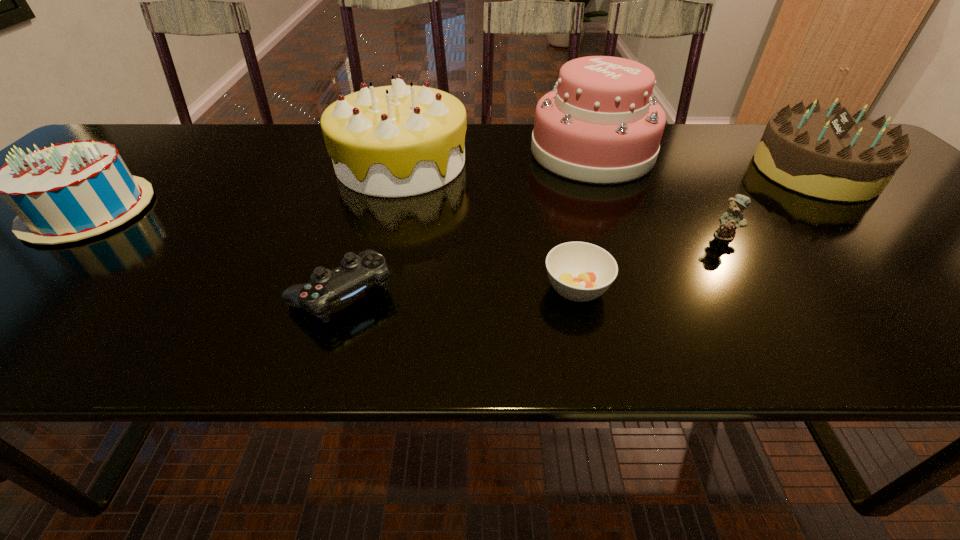
This screenshot has height=540, width=960. What are the coordinates of `vacant region at the near edge` in the screenshot? It's located at (648, 315).

This screenshot has height=540, width=960. Find the location of `free location at the left edge of the desktop`. free location at the left edge of the desktop is located at coordinates (12, 230).

This screenshot has width=960, height=540. Identify the location of vacant area at the right edge. (948, 264).

Find the location of a particular element. Image resolution: width=960 pixels, height=540 pixels. free space at the far left corner of the desktop is located at coordinates (150, 132).

At what (x,y) coordinates should I click in order to perform the action: click on vacant region between the third shortest object and the second shortest object. Please return your answer as a coordinate pair (x, y). The width and height of the screenshot is (960, 540). Looking at the image, I should click on click(534, 264).

Image resolution: width=960 pixels, height=540 pixels. I want to click on empty space that is in between the rightmost birthday cake and the fifth tallest object, so click(770, 203).

Where is `vacant space that is in between the tallest birthday cake and the sixth tallest object`? vacant space that is in between the tallest birthday cake and the sixth tallest object is located at coordinates (372, 228).

This screenshot has width=960, height=540. In order to click on empty space between the second birthday cake from left to right and the cake in this screenshot , I will do `click(496, 157)`.

Identify the location of the fifth closest object to the rightmost birthday cake. (357, 273).

Select which object is the fourth closest to the control. Please provide its 2D coordinates. Your answer should be formatted as a tuple, i.e. [(x, y)], where the tuple contains the x and y coordinates of a point satisfying the conditions above.

[(66, 192)]